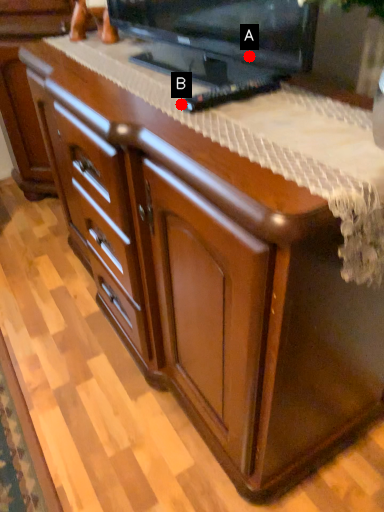
Question: Two points are circled on the image, labeled by A and B beside each circle. Which point is closer to the camera?

Choices:
 (A) A is closer
 (B) B is closer

Answer: (B)